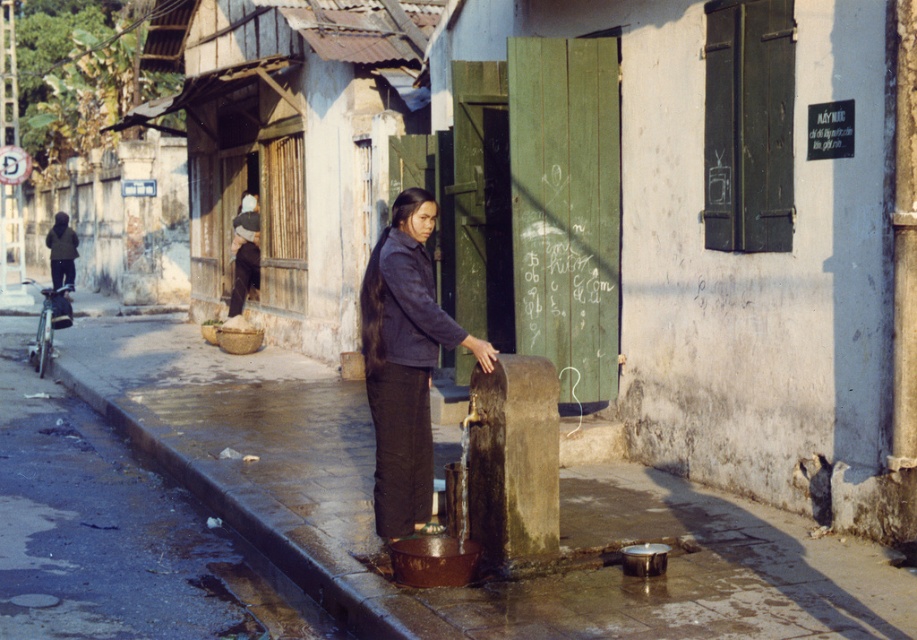
Who is lower down, rusty metal bucket at center or dark blue fabric jacket at center?

rusty metal bucket at center

Which is behind, point (576, 484) or point (439, 340)?

Positioned behind is point (576, 484).

Which is behind, point (815, 554) or point (376, 371)?

Positioned behind is point (376, 371).

You are a GUI agent. You are given a task and a screenshot of the screen. Output one action in this format:
    pyautogui.click(x=<x>, y=<y>)
    Task: Click on the rusty metal bucket at center
    The image size is (917, 640).
    Given the screenshot: What is the action you would take?
    pyautogui.click(x=487, y=582)